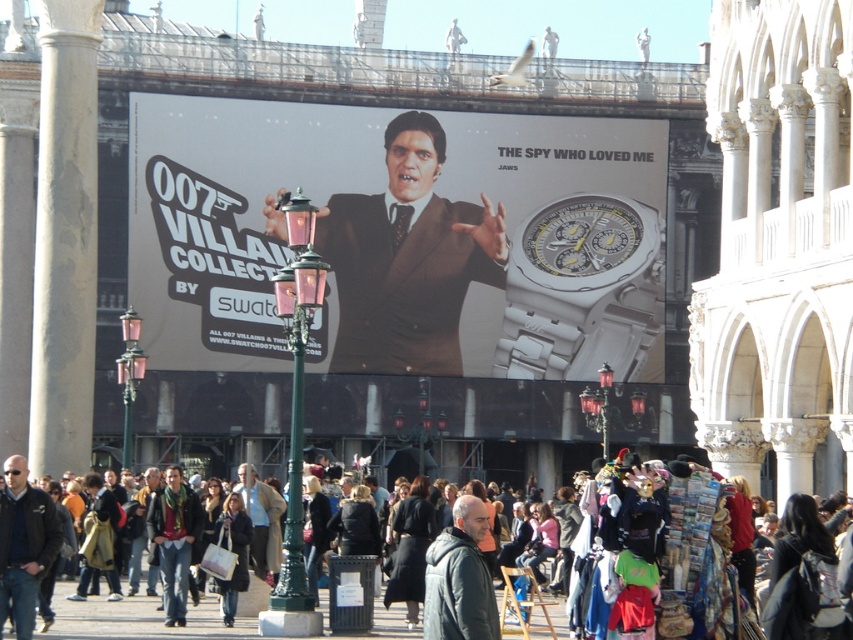
You are a fashion designer observing the urban scene. You notice the dark blue leather jacket at lower left and the green knitted scarf at center. Which item is positioned more to the left in the image?

The dark blue leather jacket at lower left is positioned more to the left than the green knitted scarf at center according to the description.

You are a photographer trying to capture the billboard advertisement for the 007 Villains Collection. You notice the white metallic watch at center and the dark blue leather jacket at lower left. Which object should you focus on first if you want to photograph the one that is positioned to the right side of the other?

The white metallic watch at center should be focused on first because it is positioned to the right of the dark blue leather jacket at lower left.

You are a fashion designer observing the billboard advertisement for the 007 Villains Collection. You notice two jackets displayed on the billboard. Which jacket is positioned lower on the billboard, the dark gray jacket at center or the dark blue leather jacket at lower left?

The dark gray jacket at center is positioned below the dark blue leather jacket at lower left, so the dark gray jacket at center is lower on the billboard.